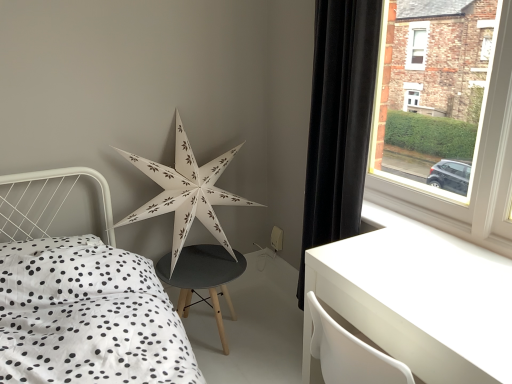
Question: Does white paper star at center have a greater width compared to white glossy table at lower right?

Choices:
 (A) no
 (B) yes

Answer: (A)

Question: Is white paper star at center surrounding white glossy table at lower right?

Choices:
 (A) no
 (B) yes

Answer: (A)

Question: Would you consider white paper star at center to be distant from white glossy table at lower right?

Choices:
 (A) yes
 (B) no

Answer: (B)

Question: Is white paper star at center outside white glossy table at lower right?

Choices:
 (A) yes
 (B) no

Answer: (A)

Question: Considering the relative sizes of white paper star at center and white glossy table at lower right in the image provided, is white paper star at center bigger than white glossy table at lower right?

Choices:
 (A) yes
 (B) no

Answer: (A)

Question: From a real-world perspective, does white paper star at center stand above white glossy table at lower right?

Choices:
 (A) no
 (B) yes

Answer: (B)

Question: Can you confirm if white glossy table at lower right is smaller than black velvet curtain at right?

Choices:
 (A) yes
 (B) no

Answer: (B)

Question: Is white glossy table at lower right shorter than black velvet curtain at right?

Choices:
 (A) no
 (B) yes

Answer: (B)

Question: From a real-world perspective, is white glossy table at lower right located beneath black velvet curtain at right?

Choices:
 (A) yes
 (B) no

Answer: (A)

Question: Can you confirm if white glossy table at lower right is positioned to the right of black velvet curtain at right?

Choices:
 (A) no
 (B) yes

Answer: (B)

Question: Considering the relative positions of white glossy table at lower right and black velvet curtain at right in the image provided, is white glossy table at lower right to the left of black velvet curtain at right from the viewer's perspective?

Choices:
 (A) yes
 (B) no

Answer: (B)

Question: Is white glossy table at lower right oriented towards black velvet curtain at right?

Choices:
 (A) no
 (B) yes

Answer: (A)

Question: Considering the relative sizes of black velvet curtain at right and white glossy table at lower right in the image provided, is black velvet curtain at right shorter than white glossy table at lower right?

Choices:
 (A) yes
 (B) no

Answer: (B)